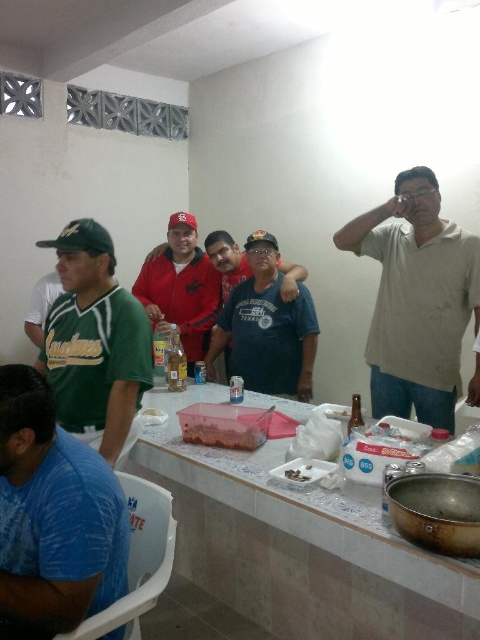
Question: Which of the following is the closest to the observer?

Choices:
 (A) (248, 433)
 (B) (315, 589)
 (C) (252, 388)

Answer: (A)

Question: Does white plastic table at center have a greater width compared to green jersey at left?

Choices:
 (A) no
 (B) yes

Answer: (B)

Question: Is blue printed t-shirt at lower left bigger than translucent plastic container at center?

Choices:
 (A) no
 (B) yes

Answer: (B)

Question: Which point appears closest to the camera in this image?

Choices:
 (A) (422, 636)
 (B) (152, 316)

Answer: (A)

Question: Which point appears closest to the camera in this image?

Choices:
 (A) (305, 467)
 (B) (287, 364)

Answer: (A)

Question: Does dark blue t-shirt at center appear on the left side of matte red jacket at center?

Choices:
 (A) no
 (B) yes

Answer: (A)